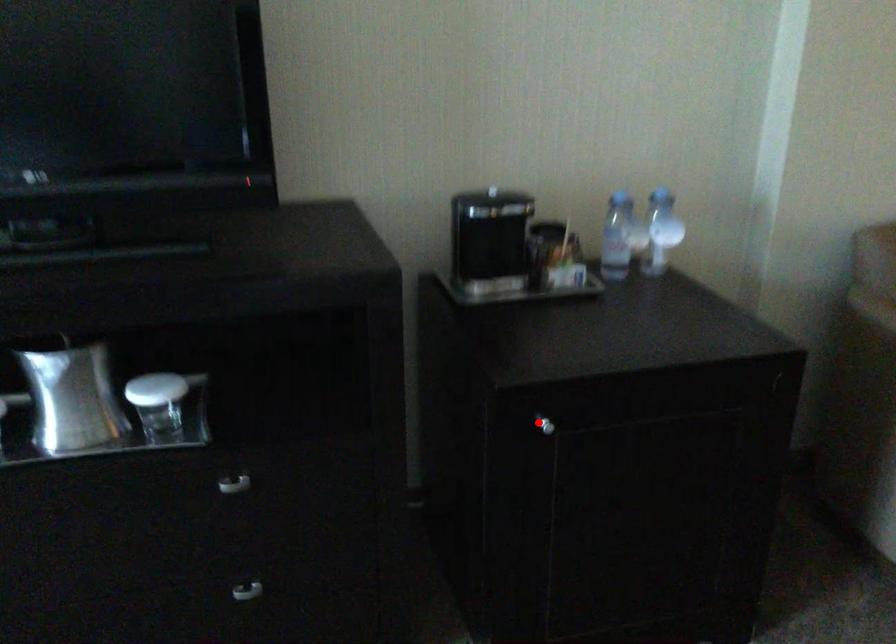
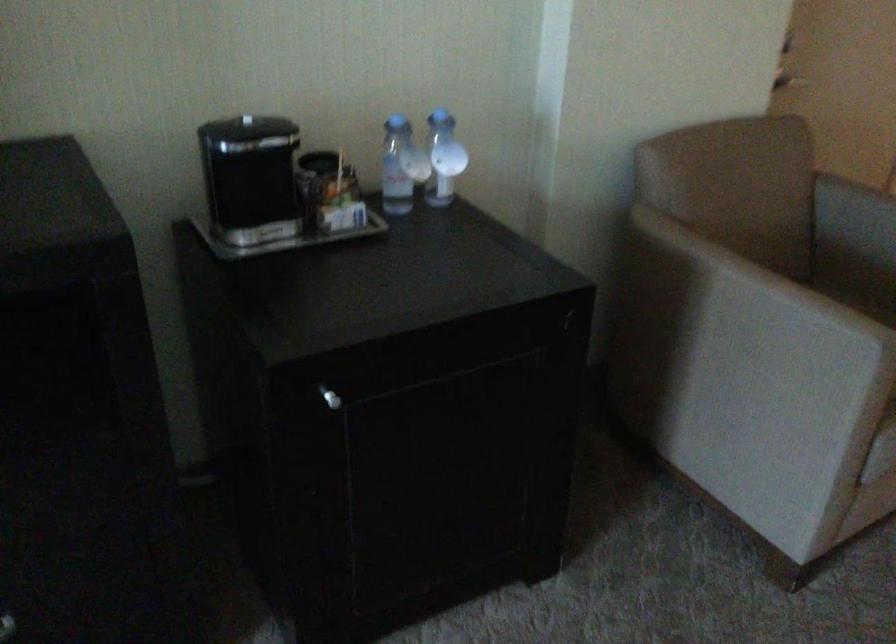
Question: A red point is marked in image1. In image2, is the corresponding 3D point closer to the camera or farther? Reply with the corresponding letter.

Choices:
 (A) The corresponding 3D point is closer.
 (B) The corresponding 3D point is farther.

Answer: (A)